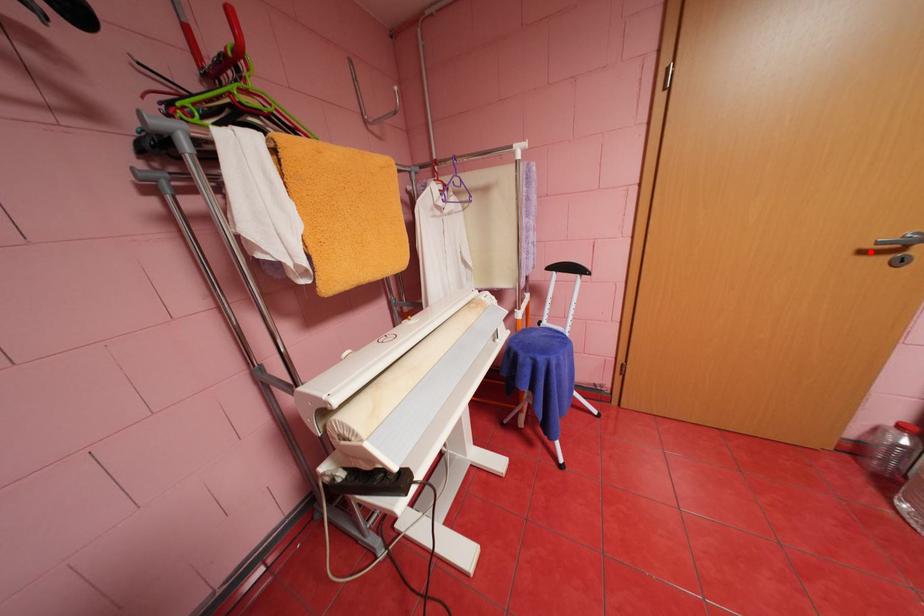
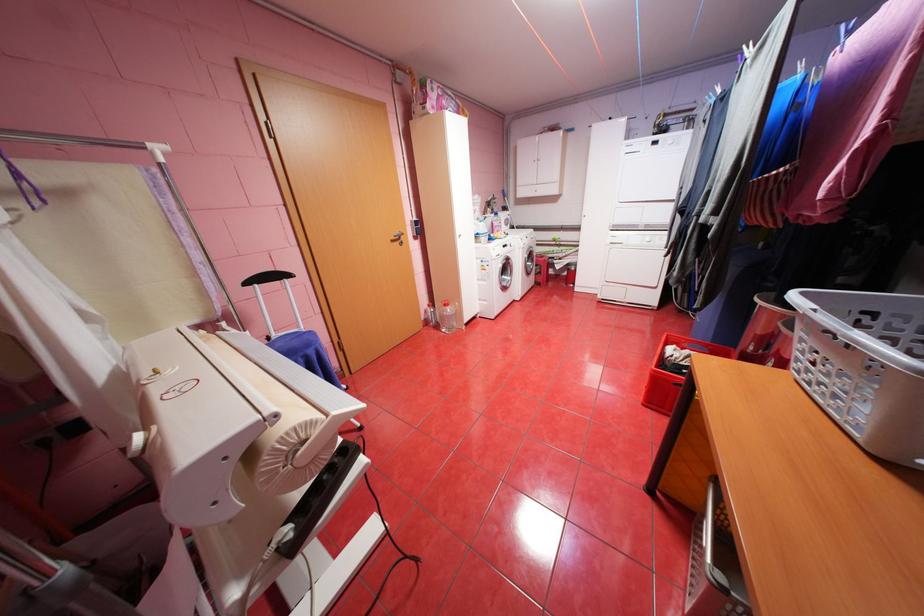
Find the pixel in the second image that matches the highlighted location in the first image.

(400, 241)